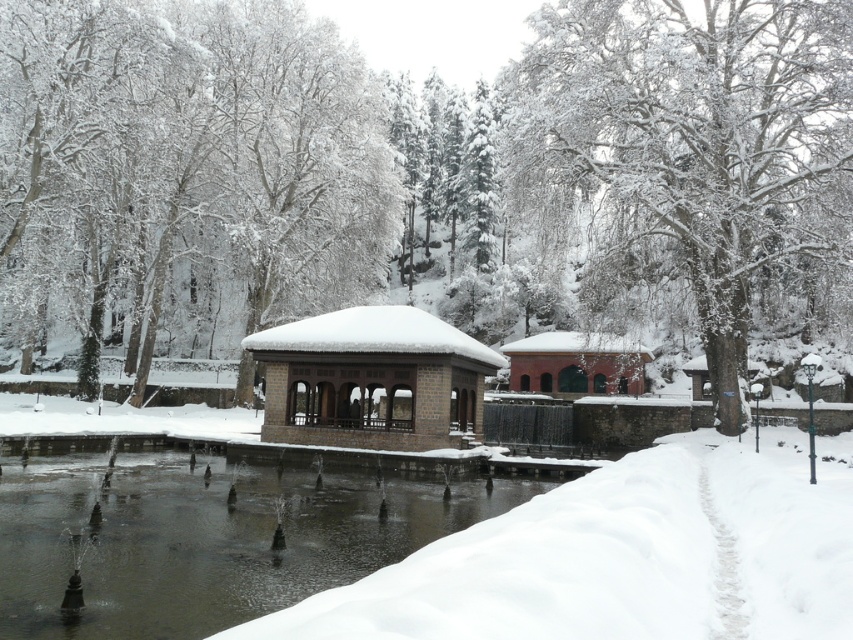
You are standing in the winter park scene and want to walk towards the two points marked in the image. Which point, point (172, 472) or point (312, 400), will you reach first?

You will reach point (172, 472) first because it is closer to you than point (312, 400).

In the scene shown: You are a delivery person trying to navigate through the park to deliver a package to the brick textured building at center. You notice white fluffy snow at lower left. Considering the height difference between them, which direction should you avoid stepping into to reach the building safely?

The white fluffy snow at lower left has a lesser height compared to the brick textured building at center. To reach the building safely, you should avoid stepping into the area with the white fluffy snow at lower left since it is lower and might be slippery or unstable compared to the higher ground near the building.

You are standing in the winter park scene and want to walk from the clear water at center to the brick textured building at center. Which direction should you go?

The clear water at center is in front of the brick textured building at center, so you should walk backward to reach the brick textured building at center from the clear water at center.